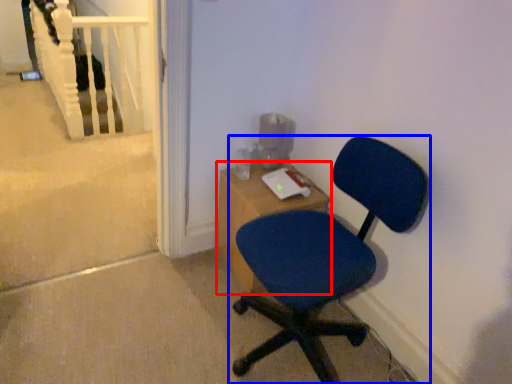
Question: Which point is further to the camera, desk (highlighted by a red box) or chair (highlighted by a blue box)?

Choices:
 (A) desk
 (B) chair

Answer: (A)